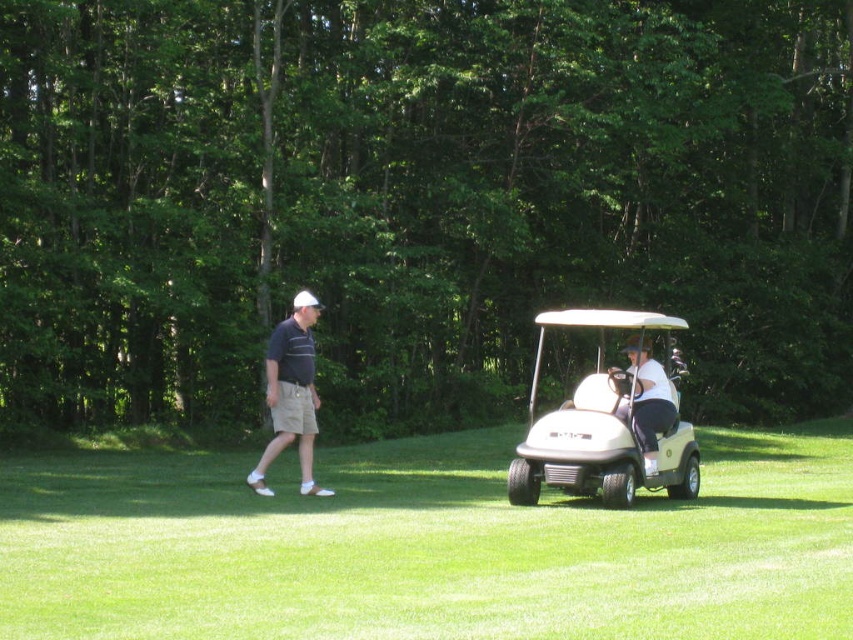
You are a golfer who wants to know which golf cart is wider. You see the white matte golf cart at center and the light green plastic golf cart at center. Which one has a greater width?

The white matte golf cart at center has a greater width than the light green plastic golf cart at center according to the description.